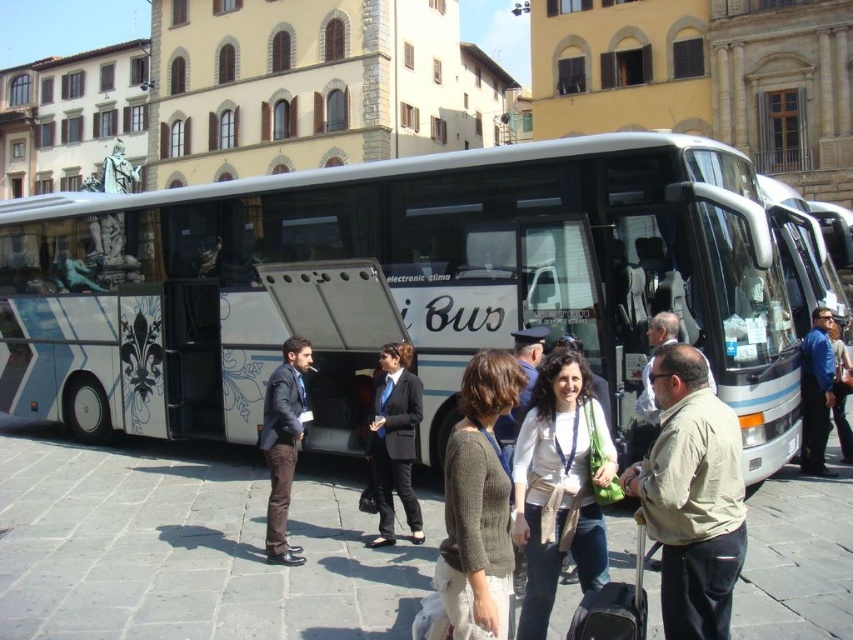
You are a tour guide standing at the center of the scene. You need to hand out a map to the person wearing the beige fabric shirt at center and the black suit at center. Which person should you approach first if you want to give the map to the wider individual?

The beige fabric shirt at center might be wider than black suit at center, so you should approach the person wearing the beige fabric shirt at center first.

You are standing at the entrance of the bus and want to find the beige fabric shirt at center. According to the coordinates provided in the Objects Description, in which direction should you look relative to your position?

The beige fabric shirt at center is located at coordinates point (692,497), which would be to the lower right direction from your position at the entrance.